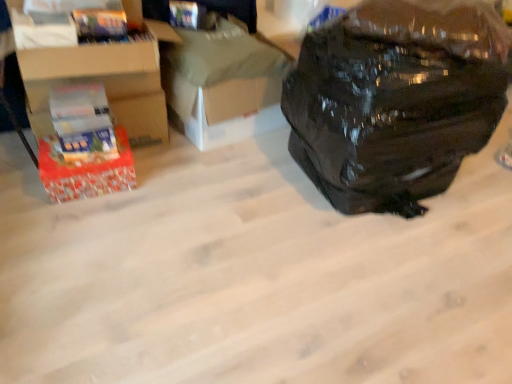
Locate an element on the screen. The width and height of the screenshot is (512, 384). free area in between black matte backpack at right and red cardboard box at left is located at coordinates (219, 195).